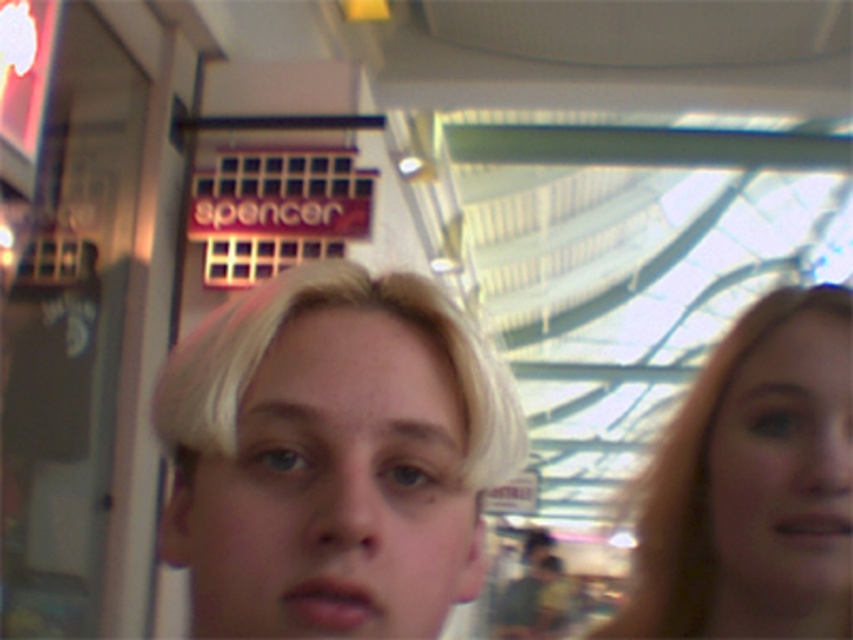
Is blonde hair at center thinner than blonde hair at right?

Indeed, blonde hair at center has a lesser width compared to blonde hair at right.

Which of these two, blonde hair at center or blonde hair at right, stands shorter?

blonde hair at center is shorter.

The image size is (853, 640). Identify the location of blonde hair at center. (332, 456).

You are a GUI agent. You are given a task and a screenshot of the screen. Output one action in this format:
    pyautogui.click(x=<x>, y=<y>)
    Task: Click on the blonde hair at center
    Image resolution: width=853 pixels, height=640 pixels.
    Given the screenshot: What is the action you would take?
    pyautogui.click(x=332, y=456)